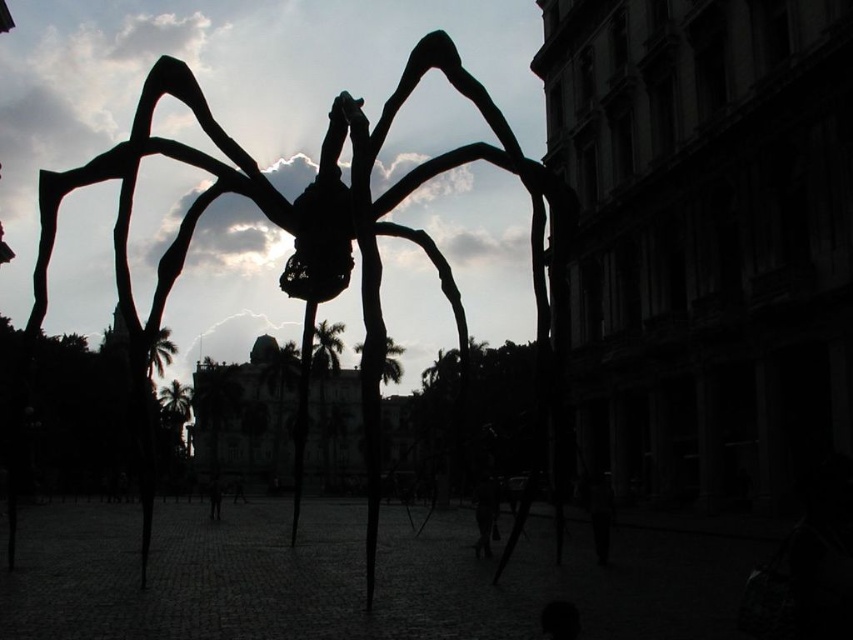
Question: Which point is farther to the camera?

Choices:
 (A) dark fabric bag at center
 (B) dark skin human at center

Answer: (B)

Question: Does silhouette metal spider at center appear over dark fabric bag at center?

Choices:
 (A) yes
 (B) no

Answer: (A)

Question: Based on their relative distances, which object is farther from the dark skin human at center?

Choices:
 (A) silhouette metal spider at center
 (B) dark fabric bag at center

Answer: (A)

Question: Is dark fabric bag at center in front of dark skin human at center?

Choices:
 (A) yes
 (B) no

Answer: (A)

Question: Which point is closer to the camera taking this photo?

Choices:
 (A) (119, 216)
 (B) (215, 513)

Answer: (A)

Question: Does silhouette metal spider at center appear on the right side of dark fabric bag at center?

Choices:
 (A) yes
 (B) no

Answer: (B)